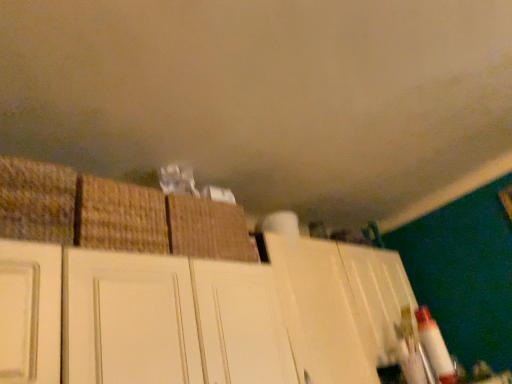
Question: Is brown woven basket at center, positioned as the 3th basket in left-to-right order, completely or partially outside of woven straw basket at left, the third basket in the right-to-left sequence?

Choices:
 (A) no
 (B) yes

Answer: (B)

Question: From the image's perspective, would you say brown woven basket at center, positioned as the 3th basket in left-to-right order, is positioned over woven straw basket at left, the third basket in the right-to-left sequence?

Choices:
 (A) no
 (B) yes

Answer: (A)

Question: Can you confirm if brown woven basket at center, positioned as the 3th basket in left-to-right order, is taller than woven straw basket at left, which is the 1th basket from left to right?

Choices:
 (A) no
 (B) yes

Answer: (A)

Question: Is brown woven basket at center, the 1th basket positioned from the right, far from woven straw basket at left, which is the 1th basket from left to right?

Choices:
 (A) no
 (B) yes

Answer: (A)

Question: Is brown woven basket at center, positioned as the 3th basket in left-to-right order, wider than woven straw basket at left, which is the 1th basket from left to right?

Choices:
 (A) no
 (B) yes

Answer: (A)

Question: From a real-world perspective, is woven straw basket at left, which is the 1th basket from left to right, above or below brown woven basket at center, the 1th basket positioned from the right?

Choices:
 (A) above
 (B) below

Answer: (A)

Question: Visually, is woven straw basket at left, the third basket in the right-to-left sequence, positioned to the left or to the right of brown woven basket at center, positioned as the 3th basket in left-to-right order?

Choices:
 (A) right
 (B) left

Answer: (B)

Question: Relative to brown woven basket at center, positioned as the 3th basket in left-to-right order, is woven straw basket at left, the third basket in the right-to-left sequence, in front or behind?

Choices:
 (A) front
 (B) behind

Answer: (A)

Question: Is point (29, 221) closer or farther from the camera than point (242, 223)?

Choices:
 (A) closer
 (B) farther

Answer: (A)

Question: Looking at the image, does white matte cabinet at upper center seem bigger or smaller compared to brown woven basket at center, the 2th basket viewed from the right?

Choices:
 (A) big
 (B) small

Answer: (A)

Question: Is white matte cabinet at upper center wider or thinner than brown woven basket at center, the second basket in the left-to-right sequence?

Choices:
 (A) wide
 (B) thin

Answer: (A)

Question: From a real-world perspective, is white matte cabinet at upper center physically located above or below brown woven basket at center, the second basket in the left-to-right sequence?

Choices:
 (A) below
 (B) above

Answer: (A)

Question: From their relative heights in the image, would you say white matte cabinet at upper center is taller or shorter than brown woven basket at center, the second basket in the left-to-right sequence?

Choices:
 (A) tall
 (B) short

Answer: (A)

Question: Is white matte cabinet at upper center taller or shorter than woven straw basket at left, the third basket in the right-to-left sequence?

Choices:
 (A) tall
 (B) short

Answer: (A)

Question: From a real-world perspective, relative to woven straw basket at left, the third basket in the right-to-left sequence, is white matte cabinet at upper center vertically above or below?

Choices:
 (A) above
 (B) below

Answer: (B)